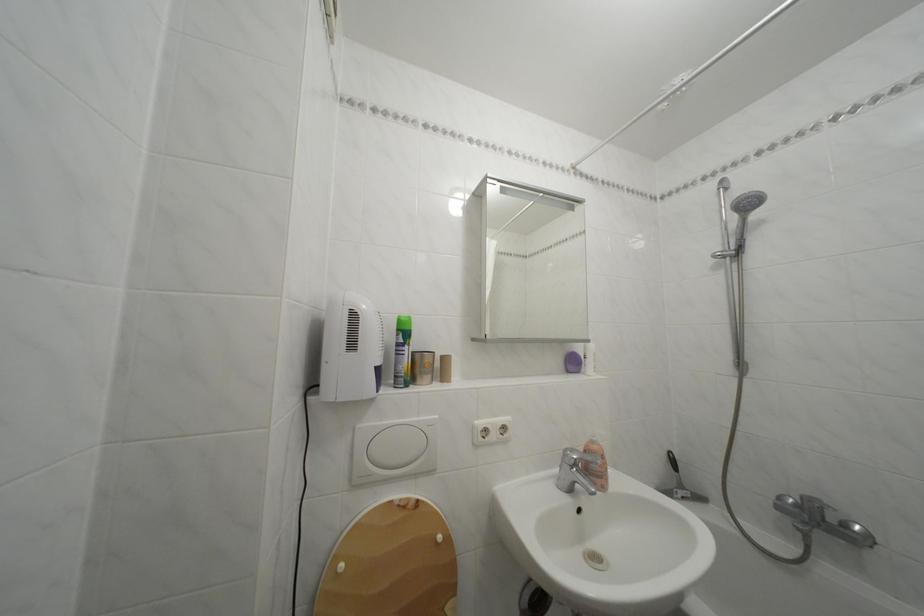
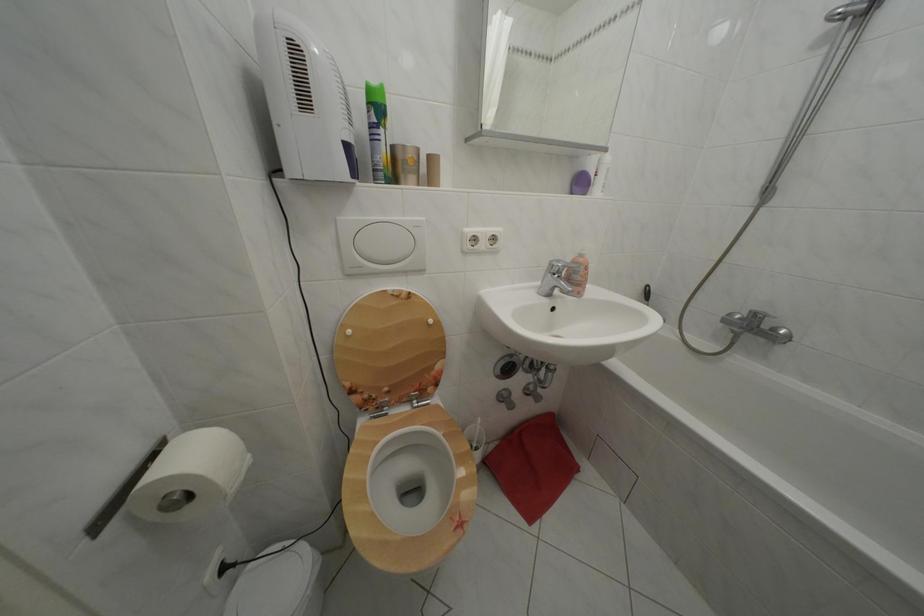
In the second image, find the point that corresponds to point 350,573 in the first image.

(358, 338)